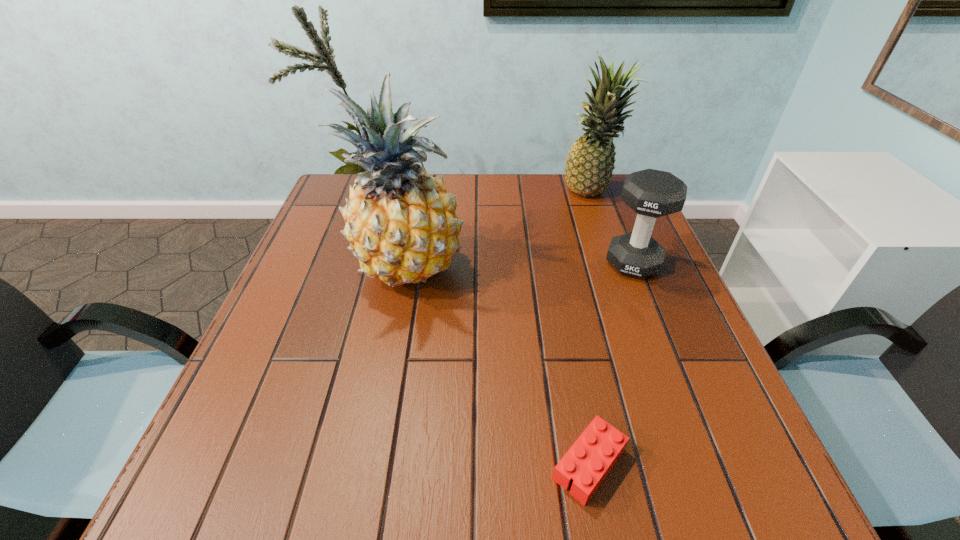
At what (x,y) coordinates should I click in order to perform the action: click on blank area located 0.060m on the left of the shortest object. Please return your answer as a coordinate pair (x, y). Looking at the image, I should click on (512, 464).

Locate an element on the screen. object at the far edge is located at coordinates (590, 162).

What are the coordinates of `object positioned at the near edge` in the screenshot? It's located at (588, 461).

Where is `object at the left edge`? The image size is (960, 540). object at the left edge is located at coordinates (401, 224).

The width and height of the screenshot is (960, 540). What are the coordinates of `pineapple positioned at the right edge` in the screenshot? It's located at (x=590, y=162).

At what (x,y) coordinates should I click in order to perform the action: click on dumbbell located in the right edge section of the desktop. Please return your answer as a coordinate pair (x, y). Looking at the image, I should click on (651, 193).

Where is `object situated at the far right corner`? The height and width of the screenshot is (540, 960). object situated at the far right corner is located at coordinates (590, 162).

Find the location of a particular element. vacant space at the far edge of the desktop is located at coordinates (468, 202).

Locate an element on the screen. The width and height of the screenshot is (960, 540). vacant space at the near edge is located at coordinates (477, 464).

Locate an element on the screen. The height and width of the screenshot is (540, 960). free spot at the left edge of the desktop is located at coordinates (334, 295).